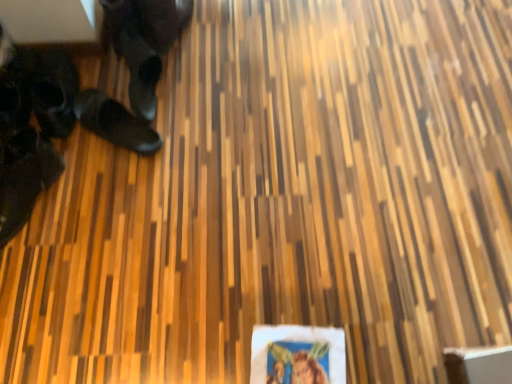
Locate an element on the screen. Image resolution: width=512 pixels, height=384 pixels. black rubber shoes at left, acting as the first footwear starting from the right is located at coordinates (x=115, y=122).

Where is `black rubber shoes at left, placed as the third footwear when sorted from left to right`? The image size is (512, 384). black rubber shoes at left, placed as the third footwear when sorted from left to right is located at coordinates (115, 122).

This screenshot has height=384, width=512. What are the coordinates of `the 1st footwear above the black leather shoes at left, placed as the 2th footwear when sorted from right to left (from a real-world perspective)` in the screenshot? It's located at (24, 177).

Which is closer to the camera, (8, 186) or (54, 96)?

Point (8, 186) is closer to the camera than point (54, 96).

From a real-world perspective, is black leather shoe at lower left, placed as the 1th footwear when sorted from left to right, on black leather shoes at left, placed as the 2th footwear when sorted from right to left?

Correct, in the physical world, black leather shoe at lower left, placed as the 1th footwear when sorted from left to right, is higher than black leather shoes at left, placed as the 2th footwear when sorted from right to left.

From a real-world perspective, between black leather shoes at left, which appears as the 2th footwear when viewed from the left, and black rubber shoes at left, placed as the third footwear when sorted from left to right, who is vertically lower?

From a 3D spatial view, black leather shoes at left, which appears as the 2th footwear when viewed from the left, is below.

Is black leather shoes at left, placed as the 2th footwear when sorted from right to left, next to black rubber shoes at left, acting as the first footwear starting from the right, and touching it?

They are not placed beside each other.

Does point (60, 57) lie in front of point (116, 112)?

No, it is behind (116, 112).

Between black leather shoes at left, which appears as the 2th footwear when viewed from the left, and black rubber shoes at left, acting as the first footwear starting from the right, which one has less height?

With less height is black rubber shoes at left, acting as the first footwear starting from the right.

Does black leather shoe at lower left, placed as the 1th footwear when sorted from left to right, turn towards black rubber shoes at left, acting as the first footwear starting from the right?

No, black leather shoe at lower left, placed as the 1th footwear when sorted from left to right, is not facing towards black rubber shoes at left, acting as the first footwear starting from the right.

Is black leather shoe at lower left, the 3th footwear when ordered from right to left, further to the viewer compared to black rubber shoes at left, acting as the first footwear starting from the right?

No.

Which point is more distant from viewer, [34,142] or [118,123]?

Point [118,123]

From a real-world perspective, between black leather shoe at lower left, placed as the 1th footwear when sorted from left to right, and black rubber shoes at left, acting as the first footwear starting from the right, who is vertically lower?

In real-world perspective, black leather shoe at lower left, placed as the 1th footwear when sorted from left to right, is lower.

Is black rubber shoes at left, acting as the first footwear starting from the right, oriented towards black leather shoes at left, placed as the 2th footwear when sorted from right to left?

No, black rubber shoes at left, acting as the first footwear starting from the right, is not facing towards black leather shoes at left, placed as the 2th footwear when sorted from right to left.

From a real-world perspective, is black rubber shoes at left, placed as the third footwear when sorted from left to right, located higher than black leather shoes at left, which appears as the 2th footwear when viewed from the left?

Yes, from a real-world perspective, black rubber shoes at left, placed as the third footwear when sorted from left to right, is above black leather shoes at left, which appears as the 2th footwear when viewed from the left.

Is black rubber shoes at left, placed as the third footwear when sorted from left to right, spatially inside black leather shoes at left, which appears as the 2th footwear when viewed from the left, or outside of it?

The correct answer is: outside.

Find the location of a particular element. This screenshot has width=512, height=384. the 1st footwear in front of the black leather shoes at left, which appears as the 2th footwear when viewed from the left, counting from the anchor's position is located at coordinates (115, 122).

The width and height of the screenshot is (512, 384). What are the coordinates of `the 2nd footwear counting from the right of the black leather shoe at lower left, placed as the 1th footwear when sorted from left to right` in the screenshot? It's located at (115, 122).

Considering the positions of objects black rubber shoes at left, placed as the third footwear when sorted from left to right, and black leather shoe at lower left, the 3th footwear when ordered from right to left, in the image provided, who is in front, black rubber shoes at left, placed as the third footwear when sorted from left to right, or black leather shoe at lower left, the 3th footwear when ordered from right to left,?

black leather shoe at lower left, the 3th footwear when ordered from right to left, is closer to the camera.

Who is smaller, black rubber shoes at left, acting as the first footwear starting from the right, or black leather shoe at lower left, placed as the 1th footwear when sorted from left to right?

Smaller between the two is black rubber shoes at left, acting as the first footwear starting from the right.

What's the angular difference between black leather shoes at left, which appears as the 2th footwear when viewed from the left, and black leather shoe at lower left, the 3th footwear when ordered from right to left,'s facing directions?

The angular difference between black leather shoes at left, which appears as the 2th footwear when viewed from the left, and black leather shoe at lower left, the 3th footwear when ordered from right to left, is 45.9 degrees.

Considering the sizes of black leather shoes at left, which appears as the 2th footwear when viewed from the left, and black leather shoe at lower left, placed as the 1th footwear when sorted from left to right, in the image, is black leather shoes at left, which appears as the 2th footwear when viewed from the left, bigger or smaller than black leather shoe at lower left, placed as the 1th footwear when sorted from left to right,?

Clearly, black leather shoes at left, which appears as the 2th footwear when viewed from the left, is smaller in size than black leather shoe at lower left, placed as the 1th footwear when sorted from left to right.

At what (x,y) coordinates should I click in order to perform the action: click on the 2nd footwear in front of the black leather shoes at left, placed as the 2th footwear when sorted from right to left, starting your count from the anchor. Please return your answer as a coordinate pair (x, y). The height and width of the screenshot is (384, 512). Looking at the image, I should click on (24, 177).

Looking at this image, does black leather shoes at left, placed as the 2th footwear when sorted from right to left, have a greater width compared to black leather shoe at lower left, the 3th footwear when ordered from right to left?

No.

Identify the location of the 2nd footwear in front when counting from the black leather shoes at left, placed as the 2th footwear when sorted from right to left. (24, 177).

Identify the location of footwear above the black rubber shoes at left, placed as the third footwear when sorted from left to right (from the image's perspective). The width and height of the screenshot is (512, 384). (54, 92).

Based on their spatial positions, is black rubber shoes at left, acting as the first footwear starting from the right, or black leather shoe at lower left, the 3th footwear when ordered from right to left, closer to black leather shoes at left, placed as the 2th footwear when sorted from right to left?

black rubber shoes at left, acting as the first footwear starting from the right, lies closer to black leather shoes at left, placed as the 2th footwear when sorted from right to left, than the other object.

When comparing their distances from black rubber shoes at left, placed as the third footwear when sorted from left to right, does black leather shoes at left, which appears as the 2th footwear when viewed from the left, or black leather shoe at lower left, placed as the 1th footwear when sorted from left to right, seem closer?

The object closer to black rubber shoes at left, placed as the third footwear when sorted from left to right, is black leather shoes at left, which appears as the 2th footwear when viewed from the left.

Which object lies further to the anchor point black leather shoe at lower left, the 3th footwear when ordered from right to left, black rubber shoes at left, acting as the first footwear starting from the right, or black leather shoes at left, placed as the 2th footwear when sorted from right to left?

Based on the image, black rubber shoes at left, acting as the first footwear starting from the right, appears to be further to black leather shoe at lower left, the 3th footwear when ordered from right to left.

Estimate the real-world distances between objects in this image. Which object is further from black leather shoes at left, placed as the 2th footwear when sorted from right to left, black leather shoe at lower left, placed as the 1th footwear when sorted from left to right, or black rubber shoes at left, placed as the third footwear when sorted from left to right?

black leather shoe at lower left, placed as the 1th footwear when sorted from left to right.

When comparing their distances from black rubber shoes at left, acting as the first footwear starting from the right, does black leather shoe at lower left, placed as the 1th footwear when sorted from left to right, or black leather shoes at left, placed as the 2th footwear when sorted from right to left, seem further?

Among the two, black leather shoe at lower left, placed as the 1th footwear when sorted from left to right, is located further to black rubber shoes at left, acting as the first footwear starting from the right.

Looking at this image, from the image, which object appears to be farther from black leather shoe at lower left, the 3th footwear when ordered from right to left, black leather shoes at left, which appears as the 2th footwear when viewed from the left, or black rubber shoes at left, placed as the third footwear when sorted from left to right?

black rubber shoes at left, placed as the third footwear when sorted from left to right.

This screenshot has width=512, height=384. Find the location of `footwear between black leather shoes at left, placed as the 2th footwear when sorted from right to left, and black leather shoe at lower left, placed as the 1th footwear when sorted from left to right, in the up-down direction`. footwear between black leather shoes at left, placed as the 2th footwear when sorted from right to left, and black leather shoe at lower left, placed as the 1th footwear when sorted from left to right, in the up-down direction is located at coordinates (115, 122).